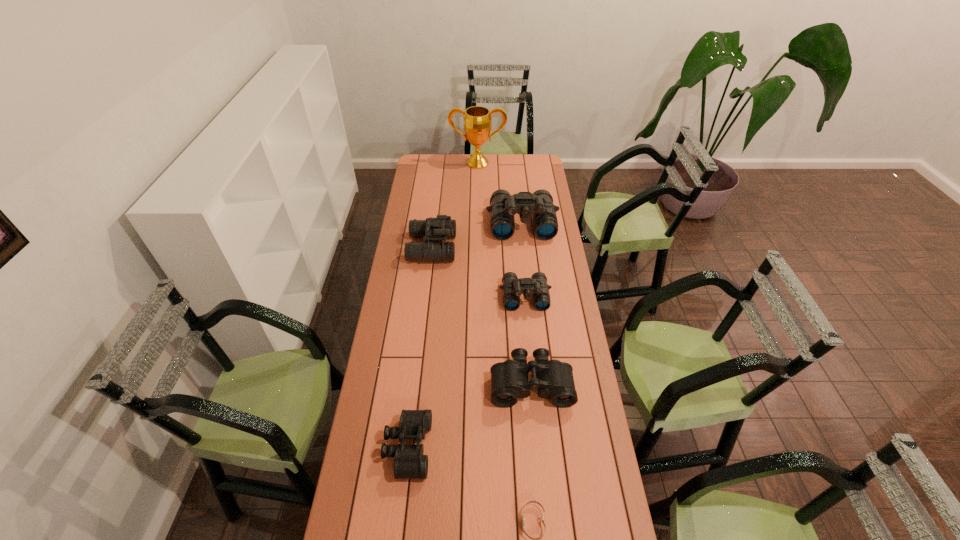
You are a GUI agent. You are given a task and a screenshot of the screen. Output one action in this format:
    pyautogui.click(x=<x>, y=<y>)
    Task: Click on the binoculars that stands as the closest to the biggest blue binoculars
    The width and height of the screenshot is (960, 540).
    Given the screenshot: What is the action you would take?
    pyautogui.click(x=442, y=227)

Identify which binoculars is located as the third nearest to the sixth shortest object. Please provide its 2D coordinates. Your answer should be formatted as a tuple, i.e. [(x, y)], where the tuple contains the x and y coordinates of a point satisfying the conditions above.

[(509, 380)]

The width and height of the screenshot is (960, 540). What are the coordinates of `the closest blue binoculars to the award` in the screenshot? It's located at (503, 206).

Locate which blue binoculars is the second closest to the farther black binoculars. Please provide its 2D coordinates. Your answer should be formatted as a tuple, i.e. [(x, y)], where the tuple contains the x and y coordinates of a point satisfying the conditions above.

[(442, 227)]

Locate an element on the screen. blank area in the image that satisfies the following two spatial constraints: 1. through the lenses of the smallest blue binoculars; 2. at the eyepieces of the sixth tallest object is located at coordinates (540, 448).

This screenshot has height=540, width=960. Identify the location of free space that satisfies the following two spatial constraints: 1. through the lenses of the sixth shortest object; 2. through the lenses of the second smallest blue binoculars. (525, 248).

This screenshot has width=960, height=540. In order to click on vacant space that satisfies the following two spatial constraints: 1. through the lenses of the nearest blue binoculars; 2. at the eyepieces of the left black binoculars in this screenshot , I will do `click(540, 448)`.

The image size is (960, 540). I want to click on free space that satisfies the following two spatial constraints: 1. on the front-facing side of the gold award; 2. through the lenses of the fourth shortest binoculars, so click(x=477, y=248).